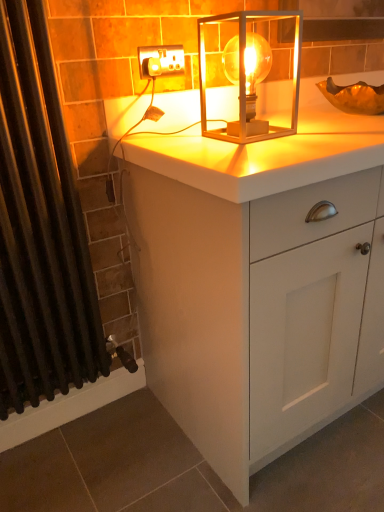
Where is `black fabric shower curtain at left`? The width and height of the screenshot is (384, 512). black fabric shower curtain at left is located at coordinates (40, 228).

Locate an element on the screen. The height and width of the screenshot is (512, 384). translucent glass lamp at center is located at coordinates (245, 74).

The width and height of the screenshot is (384, 512). In order to click on white matte cabinet at center in this screenshot , I will do `click(258, 281)`.

What's the angular difference between white plastic socket at upper center and translucent glass lamp at center's facing directions?

There is a 0.0133-degree angle between the facing directions of white plastic socket at upper center and translucent glass lamp at center.

From a real-world perspective, which object stands above the other?

In real-world perspective, white plastic socket at upper center is above.

From the image's perspective, between white plastic socket at upper center and translucent glass lamp at center, who is located below?

translucent glass lamp at center appears lower in the image.

Is white plastic socket at upper center to the right of translucent glass lamp at center from the viewer's perspective?

Incorrect, white plastic socket at upper center is not on the right side of translucent glass lamp at center.

Does translucent glass lamp at center have a lesser height compared to black fabric shower curtain at left?

Yes.

What are the coordinates of `lamp behind the black fabric shower curtain at left` in the screenshot? It's located at (245, 74).

Which of these two, translucent glass lamp at center or black fabric shower curtain at left, is bigger?

Bigger between the two is black fabric shower curtain at left.

Is black fabric shower curtain at left oriented towards white matte cabinet at center?

No, black fabric shower curtain at left is not oriented towards white matte cabinet at center.

I want to click on shower curtain in front of the white matte cabinet at center, so click(40, 228).

Considering the points (40, 179) and (334, 263), which point is behind, point (40, 179) or point (334, 263)?

The point (40, 179) is more distant.

Can you tell me how much black fabric shower curtain at left and white matte cabinet at center differ in facing direction?

They differ by 0.00113 degrees in their facing directions.

Based on the photo, considering the relative positions of translucent glass lamp at center and white matte cabinet at center in the image provided, is translucent glass lamp at center to the right of white matte cabinet at center from the viewer's perspective?

In fact, translucent glass lamp at center is to the left of white matte cabinet at center.

Considering the sizes of objects translucent glass lamp at center and white matte cabinet at center in the image provided, who is thinner, translucent glass lamp at center or white matte cabinet at center?

translucent glass lamp at center is thinner.

From the image's perspective, is translucent glass lamp at center above white matte cabinet at center?

Yes, from the image's perspective, translucent glass lamp at center is over white matte cabinet at center.

Considering the positions of point (245, 74) and point (250, 316), is point (245, 74) closer or farther from the camera than point (250, 316)?

Point (245, 74) is positioned farther from the camera compared to point (250, 316).

Considering the sizes of objects white plastic socket at upper center and black fabric shower curtain at left in the image provided, who is shorter, white plastic socket at upper center or black fabric shower curtain at left?

Standing shorter between the two is white plastic socket at upper center.

Is point (181, 72) closer to camera compared to point (68, 200)?

No, it is not.

From the image's perspective, is white plastic socket at upper center positioned above or below black fabric shower curtain at left?

From the image's perspective, white plastic socket at upper center appears above black fabric shower curtain at left.

How much distance is there between white plastic socket at upper center and black fabric shower curtain at left?

They are 22.57 inches apart.

Is white matte cabinet at center turned away from translucent glass lamp at center?

white matte cabinet at center does not have its back to translucent glass lamp at center.

Who is taller, white matte cabinet at center or translucent glass lamp at center?

white matte cabinet at center.

From a real-world perspective, is white matte cabinet at center under translucent glass lamp at center?

Correct, in the physical world, white matte cabinet at center is lower than translucent glass lamp at center.

From the image's perspective, who appears lower, translucent glass lamp at center or white plastic socket at upper center?

translucent glass lamp at center, from the image's perspective.

Between translucent glass lamp at center and white plastic socket at upper center, which one has more height?

With more height is translucent glass lamp at center.

Is translucent glass lamp at center outside of white plastic socket at upper center?

translucent glass lamp at center lies outside white plastic socket at upper center's area.

Does point (299, 35) come closer to viewer compared to point (182, 46)?

No, it is not.

Find the location of a particular element. This screenshot has width=384, height=512. electric outlet located behind the translucent glass lamp at center is located at coordinates (161, 61).

Identify the location of shower curtain below the translucent glass lamp at center (from a real-world perspective). (40, 228).

From the image, which object appears to be farther from black fabric shower curtain at left, white matte cabinet at center or translucent glass lamp at center?

translucent glass lamp at center is positioned further to the anchor black fabric shower curtain at left.

Which object lies nearer to the anchor point translucent glass lamp at center, black fabric shower curtain at left or white plastic socket at upper center?

Answer: Among the two, white plastic socket at upper center is located nearer to translucent glass lamp at center.

Which object lies nearer to the anchor point white matte cabinet at center, translucent glass lamp at center or white plastic socket at upper center?

translucent glass lamp at center is closer to white matte cabinet at center.

Based on their spatial positions, is white matte cabinet at center or black fabric shower curtain at left closer to white plastic socket at upper center?

black fabric shower curtain at left is closer to white plastic socket at upper center.

Based on their spatial positions, is white plastic socket at upper center or white matte cabinet at center closer to translucent glass lamp at center?

The object closer to translucent glass lamp at center is white plastic socket at upper center.

Which object lies further to the anchor point white plastic socket at upper center, black fabric shower curtain at left or translucent glass lamp at center?

Based on the image, black fabric shower curtain at left appears to be further to white plastic socket at upper center.

Looking at the image, which one is located closer to white plastic socket at upper center, white matte cabinet at center or translucent glass lamp at center?

Based on the image, translucent glass lamp at center appears to be nearer to white plastic socket at upper center.

Looking at this image, based on their spatial positions, is white plastic socket at upper center or white matte cabinet at center further from black fabric shower curtain at left?

white plastic socket at upper center is further to black fabric shower curtain at left.

Locate an element on the screen. The width and height of the screenshot is (384, 512). lamp situated between black fabric shower curtain at left and white matte cabinet at center from left to right is located at coordinates (245, 74).

Identify the location of lamp between white plastic socket at upper center and white matte cabinet at center vertically. This screenshot has height=512, width=384. (245, 74).

Where is `electric outlet situated between black fabric shower curtain at left and translucent glass lamp at center from left to right`? The image size is (384, 512). electric outlet situated between black fabric shower curtain at left and translucent glass lamp at center from left to right is located at coordinates (161, 61).

Identify the location of electric outlet between black fabric shower curtain at left and white matte cabinet at center in the horizontal direction. The image size is (384, 512). (161, 61).